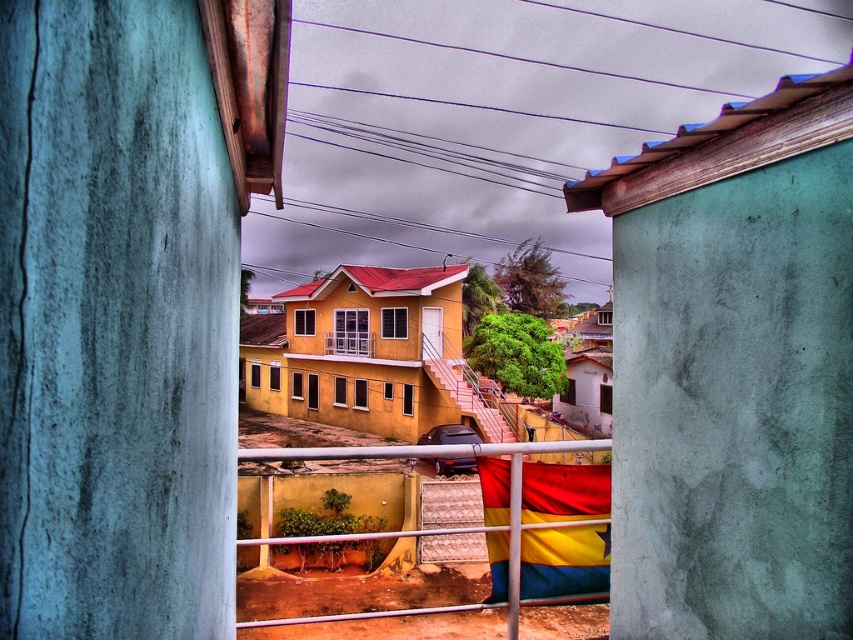
Question: Which point is farther to the camera?

Choices:
 (A) metallic silver fence at center
 (B) white painted wood balcony at center

Answer: (B)

Question: Which point is closer to the camera taking this photo?

Choices:
 (A) (366, 348)
 (B) (373, 454)

Answer: (B)

Question: Is metallic silver fence at center positioned before white painted wood balcony at center?

Choices:
 (A) yes
 (B) no

Answer: (A)

Question: Can you confirm if metallic silver fence at center is smaller than white painted wood balcony at center?

Choices:
 (A) yes
 (B) no

Answer: (B)

Question: Among these points, which one is nearest to the camera?

Choices:
 (A) (409, 484)
 (B) (335, 342)

Answer: (A)

Question: Is metallic silver fence at center closer to camera compared to white painted wood balcony at center?

Choices:
 (A) no
 (B) yes

Answer: (B)